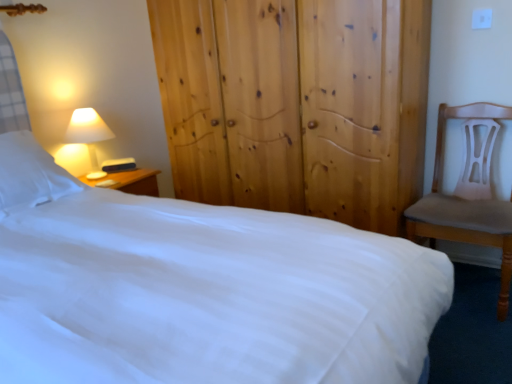
Question: From a real-world perspective, is white soft pillow at left physically below light brown wooden chair at right?

Choices:
 (A) no
 (B) yes

Answer: (A)

Question: Would you consider white soft pillow at left to be distant from light brown wooden chair at right?

Choices:
 (A) no
 (B) yes

Answer: (B)

Question: From a real-world perspective, is white soft pillow at left over light brown wooden chair at right?

Choices:
 (A) yes
 (B) no

Answer: (A)

Question: Is white soft pillow at left facing towards light brown wooden chair at right?

Choices:
 (A) no
 (B) yes

Answer: (A)

Question: Is light brown wooden chair at right a part of white soft pillow at left?

Choices:
 (A) no
 (B) yes

Answer: (A)

Question: Can you confirm if white soft pillow at left is taller than light brown wooden chair at right?

Choices:
 (A) yes
 (B) no

Answer: (B)

Question: Is natural wood wardrobe at center with white soft pillow at left?

Choices:
 (A) yes
 (B) no

Answer: (B)

Question: Does natural wood wardrobe at center have a smaller size compared to white soft pillow at left?

Choices:
 (A) no
 (B) yes

Answer: (A)

Question: From the image's perspective, is natural wood wardrobe at center beneath white soft pillow at left?

Choices:
 (A) no
 (B) yes

Answer: (A)

Question: Can you confirm if natural wood wardrobe at center is thinner than white soft pillow at left?

Choices:
 (A) no
 (B) yes

Answer: (A)

Question: Could you tell me if natural wood wardrobe at center is facing white soft pillow at left?

Choices:
 (A) no
 (B) yes

Answer: (B)

Question: Is natural wood wardrobe at center behind white soft pillow at left?

Choices:
 (A) no
 (B) yes

Answer: (A)

Question: From the image's perspective, is white smooth bed at center on matte white lampshade at left?

Choices:
 (A) no
 (B) yes

Answer: (A)